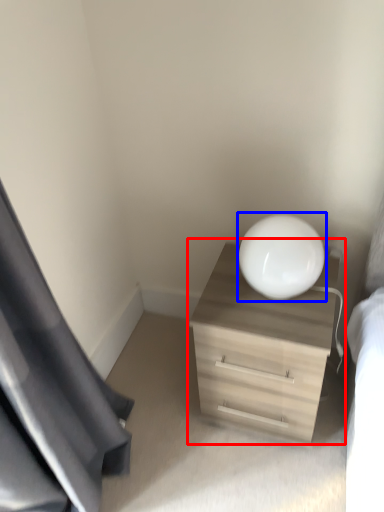
Question: Among these objects, which one is nearest to the camera, dresser (highlighted by a red box) or round table (highlighted by a blue box)?

Choices:
 (A) dresser
 (B) round table

Answer: (B)